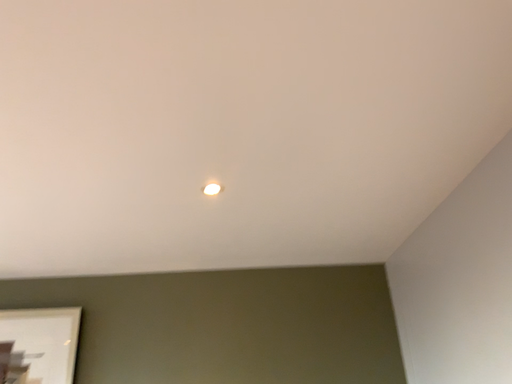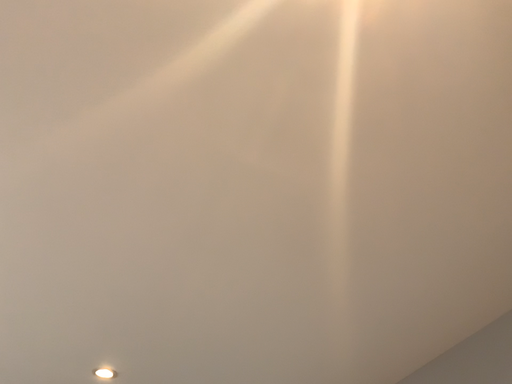
Question: How did the camera likely rotate when shooting the video?

Choices:
 (A) rotated upward
 (B) rotated downward

Answer: (A)